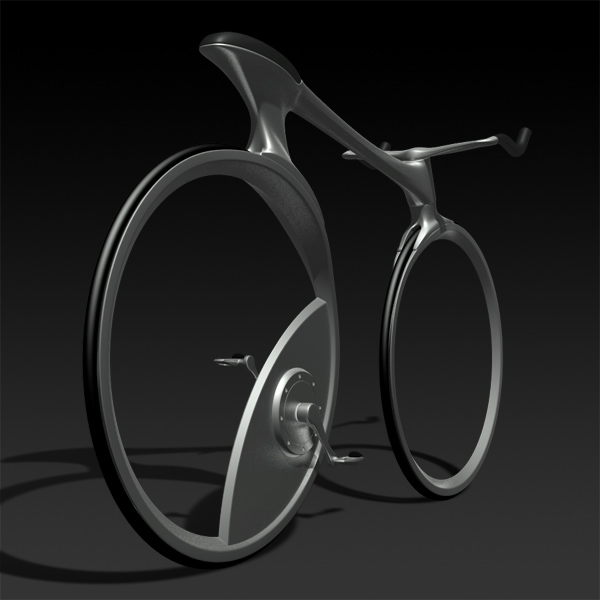
Locate an element on the screen. This screenshot has height=600, width=600. screws is located at coordinates (280, 417).